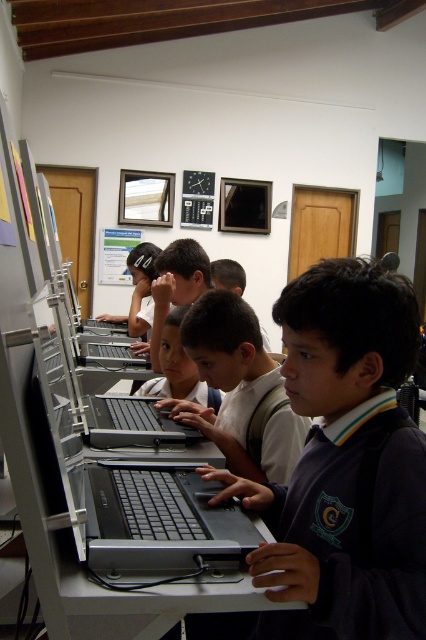
Question: Which point is closer to the camera?

Choices:
 (A) smooth skin child at center
 (B) silver metallic laptop at center
 (C) matte black laptop at center
 (D) black matte laptop at center

Answer: (C)

Question: Which of the following is the farthest from the observer?

Choices:
 (A) black plastic laptop at center
 (B) black matte laptop at center

Answer: (B)

Question: Considering the relative positions of matte black laptop at center and smooth skin child at center in the image provided, where is matte black laptop at center located with respect to smooth skin child at center?

Choices:
 (A) right
 (B) left

Answer: (A)

Question: Does dark blue uniform at center have a larger size compared to matte black laptop at center?

Choices:
 (A) yes
 (B) no

Answer: (A)

Question: Among these objects, which one is nearest to the camera?

Choices:
 (A) black matte laptop at center
 (B) matte black laptop at center
 (C) silver metallic laptop at center

Answer: (B)

Question: Does matte black laptop at center have a smaller size compared to silver metallic laptop at center?

Choices:
 (A) yes
 (B) no

Answer: (B)